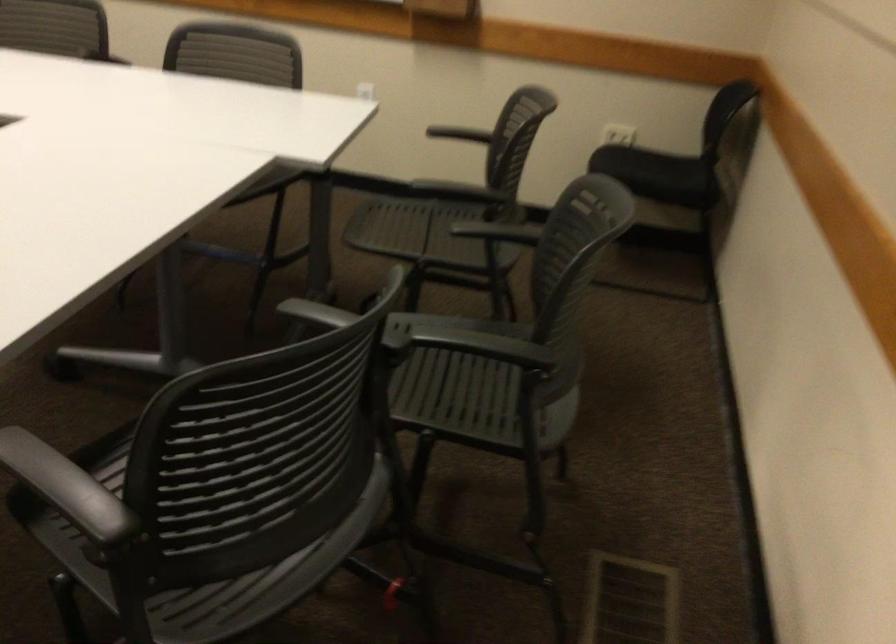
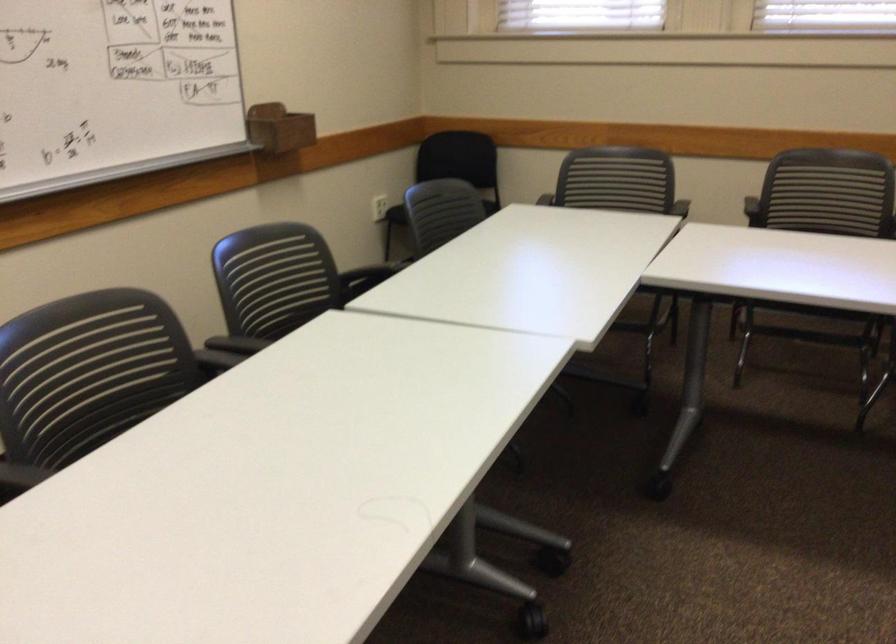
In the second image, find the point that corresponds to point 304,73 in the first image.

(441, 212)